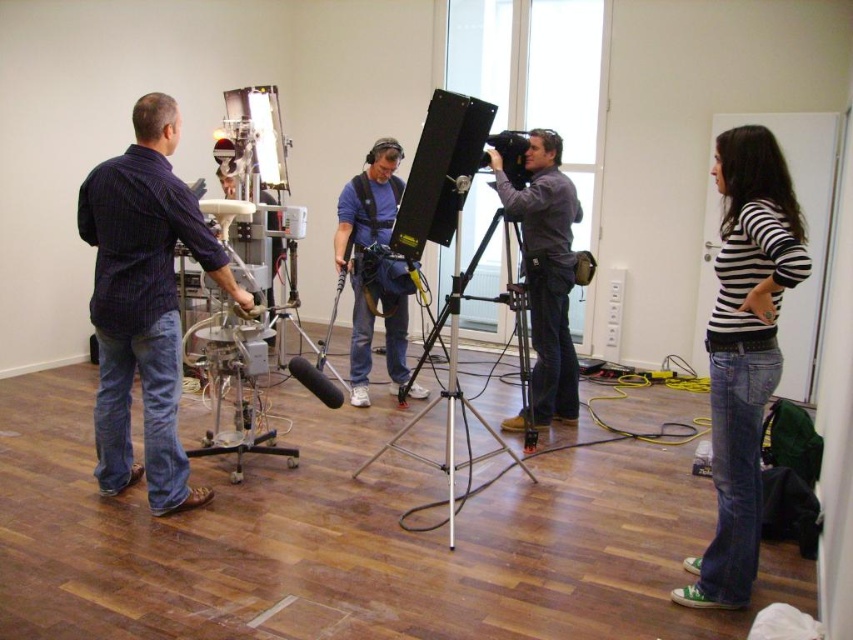
You are a production assistant in the studio and need to determine the spatial relationship between the matte blue shirt at center and the black plastic video camera at center. Which object is wider?

The matte blue shirt at center is wider than the black plastic video camera at center according to the description.